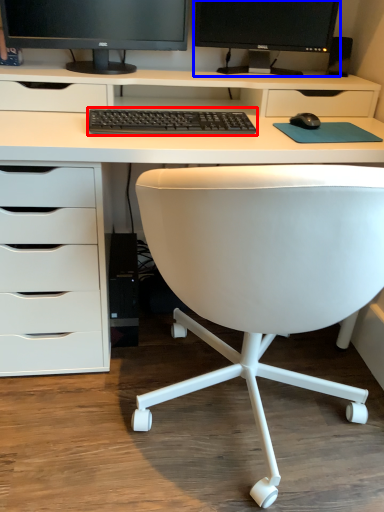
Question: Which of the following is the closest to the observer, computer keyboard (highlighted by a red box) or computer monitor (highlighted by a blue box)?

Choices:
 (A) computer keyboard
 (B) computer monitor

Answer: (A)